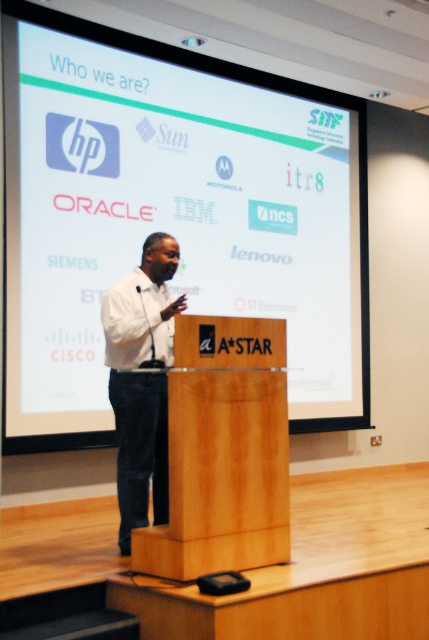
Question: Which point appears farthest from the camera in this image?

Choices:
 (A) (274, 333)
 (B) (6, 344)

Answer: (B)

Question: Is white matte projection screen at upper center bigger than wooden podium at center?

Choices:
 (A) no
 (B) yes

Answer: (B)

Question: Is wooden podium at center further to camera compared to white matte shirt at center?

Choices:
 (A) no
 (B) yes

Answer: (A)

Question: Can you confirm if white matte projection screen at upper center is positioned above wooden podium at center?

Choices:
 (A) yes
 (B) no

Answer: (A)

Question: Which of the following is the closest to the observer?

Choices:
 (A) (160, 564)
 (B) (145, 337)

Answer: (A)

Question: Considering the real-world distances, which object is farthest from the wooden podium at center?

Choices:
 (A) white matte shirt at center
 (B) white matte projection screen at upper center

Answer: (B)